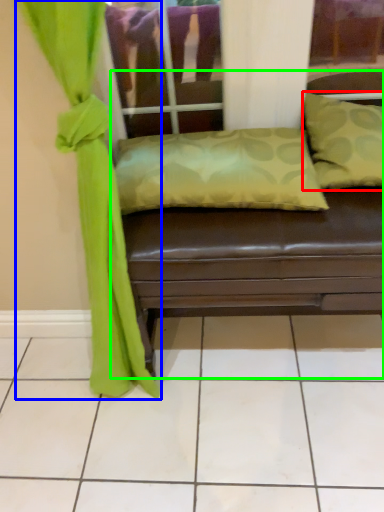
Question: Estimate the real-world distances between objects in this image. Which object is closer to pillow (highlighted by a red box), curtain (highlighted by a blue box) or studio couch (highlighted by a green box)?

Choices:
 (A) curtain
 (B) studio couch

Answer: (B)